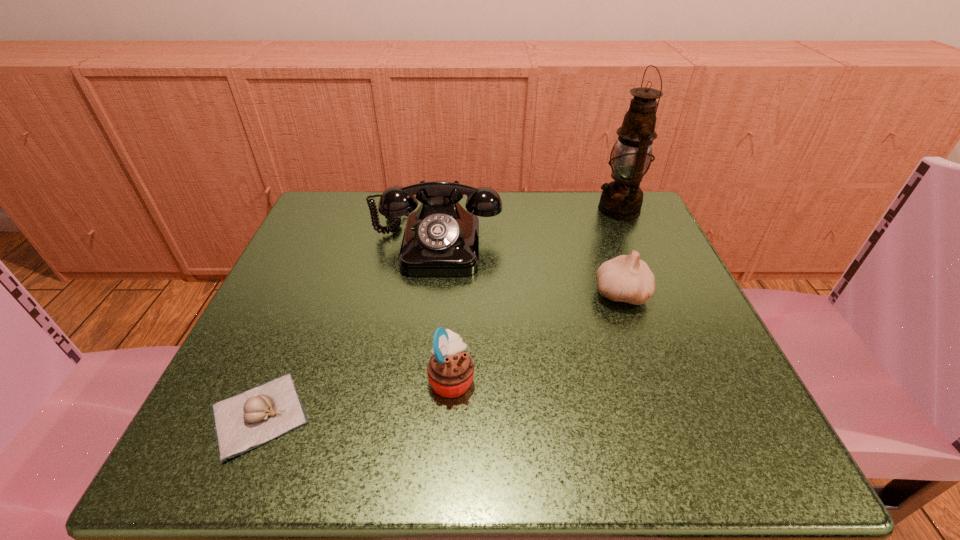
Find the location of a particular element. The image size is (960, 540). free location that satisfies the following two spatial constraints: 1. on the front side of the oil lamp; 2. on the front-facing side of the muffin is located at coordinates (693, 379).

Where is `free location that satisfies the following two spatial constraints: 1. on the dial of the telephone; 2. on the right side of the farther garlic`? This screenshot has height=540, width=960. free location that satisfies the following two spatial constraints: 1. on the dial of the telephone; 2. on the right side of the farther garlic is located at coordinates (430, 294).

This screenshot has height=540, width=960. In order to click on blank space that satisfies the following two spatial constraints: 1. on the back side of the oil lamp; 2. on the right side of the leftmost object in this screenshot , I will do `click(346, 209)`.